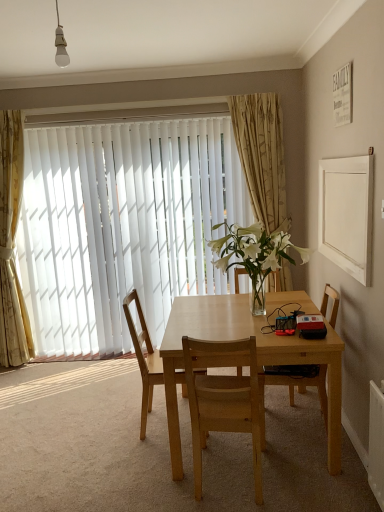
At what (x,y) coordinates should I click in order to perform the action: click on free space above light wood table at center (from a real-world perspective). Please return your answer as a coordinate pair (x, y). This screenshot has width=384, height=512. Looking at the image, I should click on (242, 314).